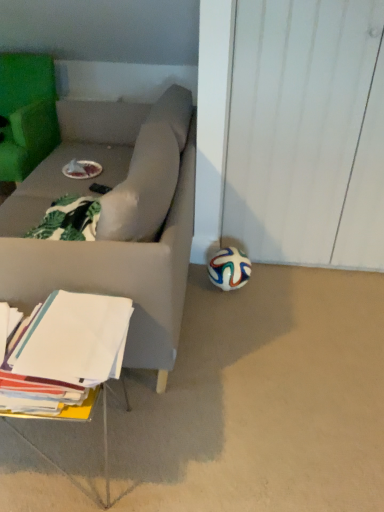
Locate an element on the screen. vacant space to the right of multicolored rubber ball at lower right is located at coordinates (271, 275).